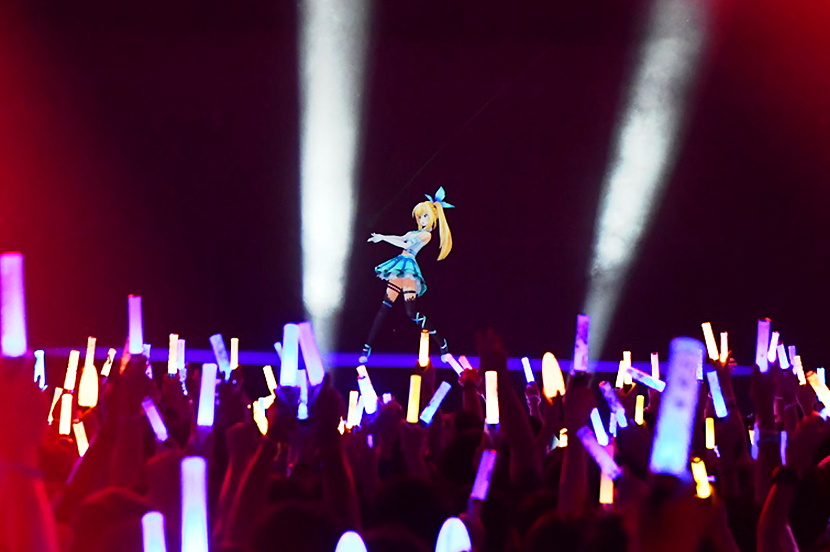
Identify the location of stage. (381, 367).